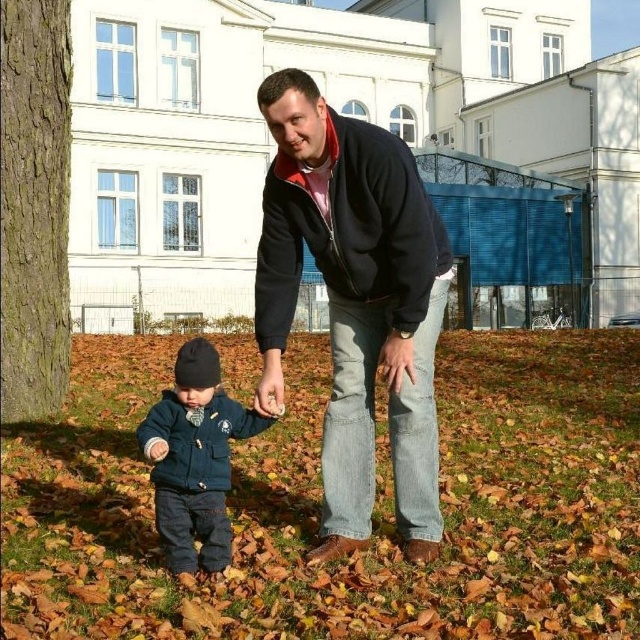
Can you confirm if dark blue fleece sweatshirt at center is positioned below dark blue fleece jacket at lower left?

No, dark blue fleece sweatshirt at center is not below dark blue fleece jacket at lower left.

Between dark blue fleece sweatshirt at center and dark blue fleece jacket at lower left, which one is positioned lower?

dark blue fleece jacket at lower left is below.

Between point (390, 209) and point (179, 486), which one is positioned behind?

Point (390, 209)

I want to click on dark blue fleece sweatshirt at center, so click(349, 230).

Can you confirm if matte black jacket at center is positioned to the left of dark blue fleece jacket at lower left?

No, matte black jacket at center is not to the left of dark blue fleece jacket at lower left.

Which is behind, point (300, 260) or point (188, 513)?

The point (300, 260) is more distant.

I want to click on matte black jacket at center, so click(355, 304).

Is matte black jacket at center to the left of dark blue fleece sweatshirt at center from the viewer's perspective?

No, matte black jacket at center is not to the left of dark blue fleece sweatshirt at center.

Does matte black jacket at center have a smaller size compared to dark blue fleece sweatshirt at center?

Actually, matte black jacket at center might be larger than dark blue fleece sweatshirt at center.

Find the location of a particular element. The width and height of the screenshot is (640, 640). matte black jacket at center is located at coordinates (355, 304).